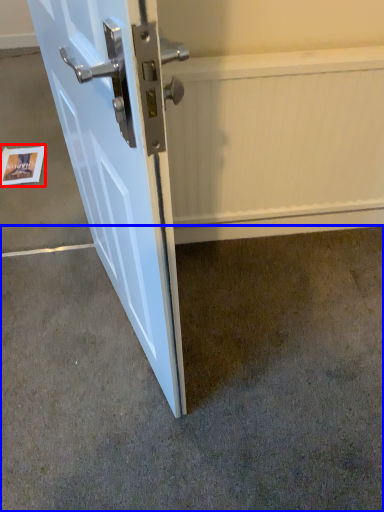
Question: Which point is closer to the camera, postcard (highlighted by a red box) or concrete (highlighted by a blue box)?

Choices:
 (A) postcard
 (B) concrete

Answer: (B)